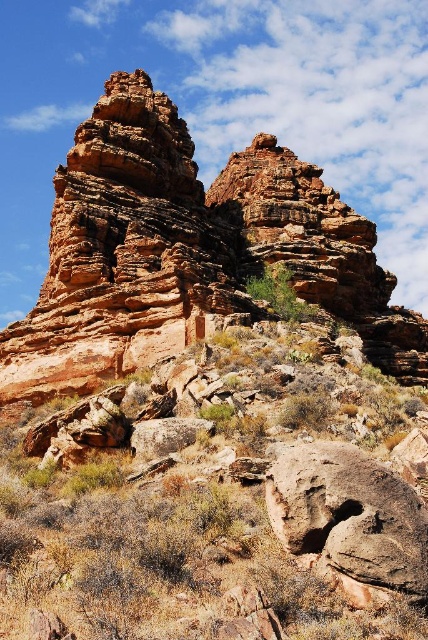
Question: In this image, where is rustic rock hillside at center located relative to rustic sandstone rock formation at center?

Choices:
 (A) above
 (B) below

Answer: (B)

Question: In this image, where is rustic rock hillside at center located relative to rusty rock at lower right?

Choices:
 (A) right
 (B) left

Answer: (B)

Question: Which object is farther from the camera taking this photo?

Choices:
 (A) rusty rock at lower right
 (B) rustic sandstone rock formation at center
 (C) rustic rock hillside at center

Answer: (B)

Question: Which object is farther from the camera taking this photo?

Choices:
 (A) rustic sandstone rock formation at center
 (B) rustic rock hillside at center

Answer: (A)

Question: Which object is farther from the camera taking this photo?

Choices:
 (A) rustic sandstone rock formation at center
 (B) rusty rock at lower right
 (C) rustic rock hillside at center

Answer: (A)

Question: Is rustic rock hillside at center positioned behind rusty rock at lower right?

Choices:
 (A) yes
 (B) no

Answer: (B)